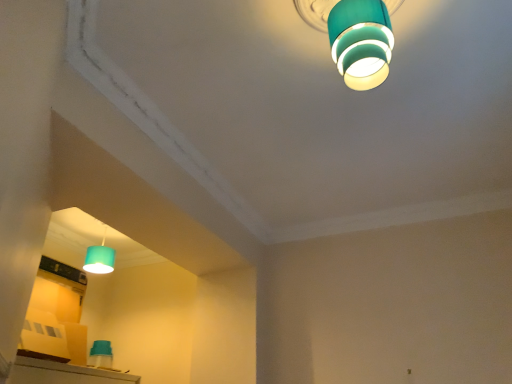
Measure the distance between teal matte lampshade at lower left and camera.

The distance of teal matte lampshade at lower left from camera is 3.88 meters.

What do you see at coordinates (100, 258) in the screenshot? This screenshot has width=512, height=384. I see `teal matte lampshade at lower left` at bounding box center [100, 258].

Identify the location of teal matte lampshade at lower left. The width and height of the screenshot is (512, 384). (100, 258).

Consider the image. Measure the distance between point (92, 250) and camera.

A distance of 12.91 feet exists between point (92, 250) and camera.

You are a GUI agent. You are given a task and a screenshot of the screen. Output one action in this format:
    pyautogui.click(x=<x>, y=<y>)
    Task: Click on the teal matte lampshade at lower left
    The image size is (512, 384).
    Given the screenshot: What is the action you would take?
    pyautogui.click(x=100, y=258)